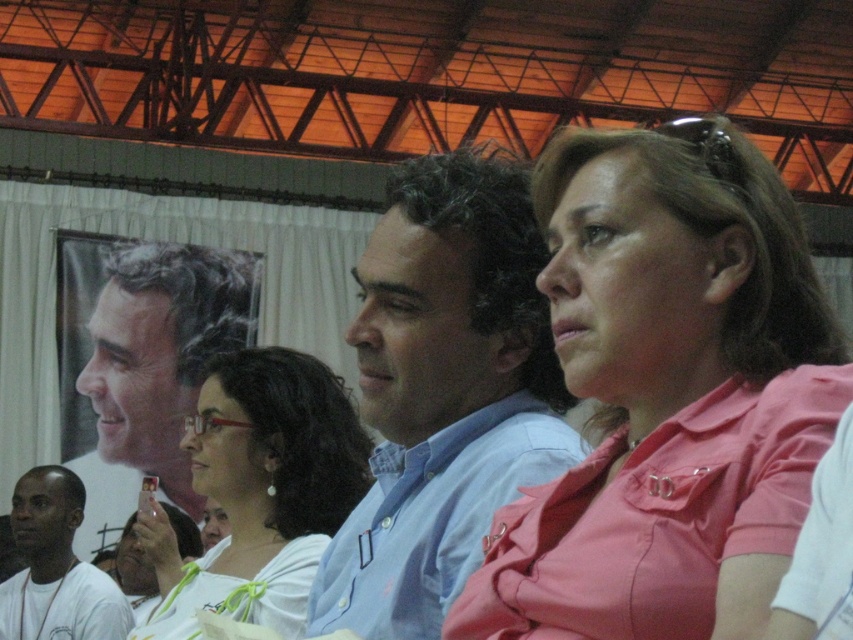
Question: Is pink fabric shirt at center above white matte shirt at lower left?

Choices:
 (A) yes
 (B) no

Answer: (A)

Question: Does light blue shirt at center appear under white matte shirt at lower left?

Choices:
 (A) no
 (B) yes

Answer: (A)

Question: Estimate the real-world distances between objects in this image. Which object is closer to the white fabric shirt at center?

Choices:
 (A) white matte shirt at lower left
 (B) pink fabric shirt at center
 (C) smooth skin portrait at center

Answer: (B)

Question: Based on their relative distances, which object is nearer to the smooth skin portrait at center?

Choices:
 (A) white fabric shirt at center
 (B) white matte shirt at lower left

Answer: (B)

Question: Which of these objects is positioned farthest from the light blue shirt at center?

Choices:
 (A) pink fabric shirt at center
 (B) white fabric shirt at center
 (C) white matte shirt at lower left

Answer: (C)

Question: Is pink fabric shirt at center smaller than light blue shirt at center?

Choices:
 (A) no
 (B) yes

Answer: (A)